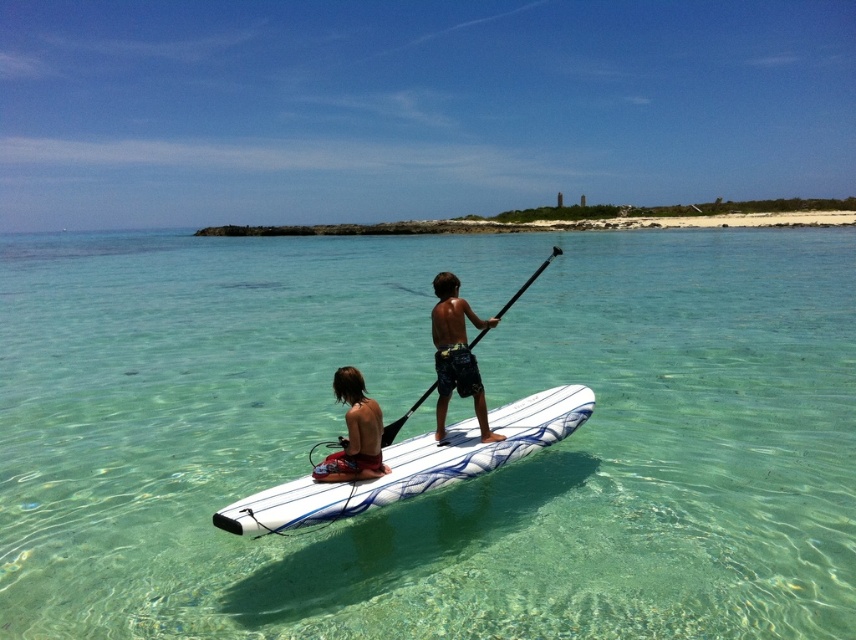
Is matte red shorts at lower left smaller than black matte paddle at center?

Yes.

Which is above, matte red shorts at lower left or black matte paddle at center?

black matte paddle at center

Between point (342, 451) and point (409, 410), which one is positioned in front?

Point (342, 451)

Identify the location of matte red shorts at lower left. Image resolution: width=856 pixels, height=640 pixels. (354, 433).

Can you confirm if clear glassy water at center is wider than black matte paddle at center?

Yes.

Is point (256, 376) farther from viewer compared to point (474, 337)?

Yes, point (256, 376) is farther from viewer.

Which is behind, point (153, 330) or point (471, 342)?

Point (153, 330)

This screenshot has width=856, height=640. Identify the location of clear glassy water at center. (403, 408).

Between dark blue board shorts at center and black matte paddle at center, which one appears on the right side from the viewer's perspective?

black matte paddle at center

Between dark blue board shorts at center and black matte paddle at center, which one is positioned lower?

Positioned lower is dark blue board shorts at center.

Who is more forward, (456, 291) or (480, 330)?

Point (456, 291)

Where is `dark blue board shorts at center`? The height and width of the screenshot is (640, 856). dark blue board shorts at center is located at coordinates (456, 355).